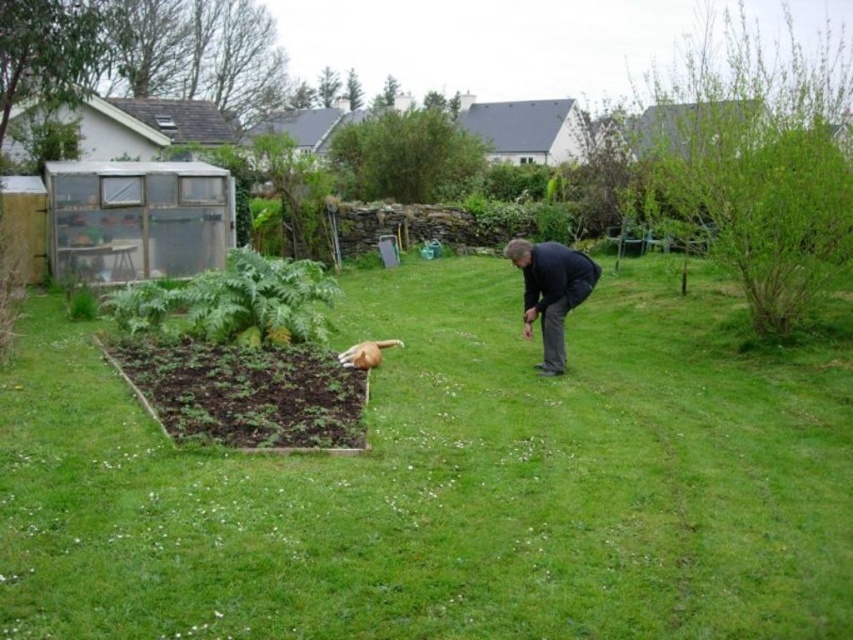
You are standing in the backyard and want to know if the green grass at center is wider than the brown fur dog at lower center. Can you determine this based on the scene?

The green grass at center might be wider than brown fur dog at lower center according to the scene description.

You are standing in the backyard and want to take a photo of the brown fur dog at lower center without the green grass at center appearing in the foreground. Is this possible based on their positions?

The green grass at center is closer to the viewer than the brown fur dog at lower center. Therefore, it would be challenging to take a photo of the brown fur dog at lower center without the green grass at center appearing in the foreground since the grass is in front of the dog.

You are standing in the backyard and see the green grass at center and the dark blue jacket at center. Which object is located to the left of the other?

The green grass at center is positioned on the left side of dark blue jacket at center.